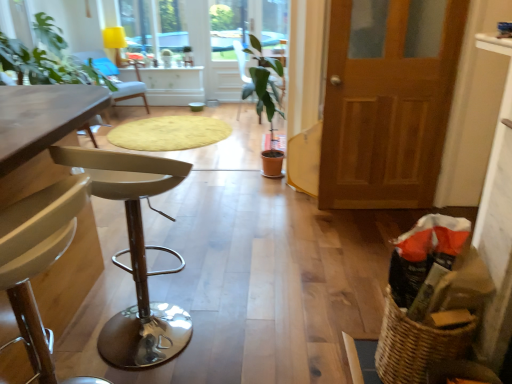
Locate an element on the screen. Image resolution: width=512 pixels, height=384 pixels. vacant space positioned to the left of woven brown basket at lower right is located at coordinates (332, 349).